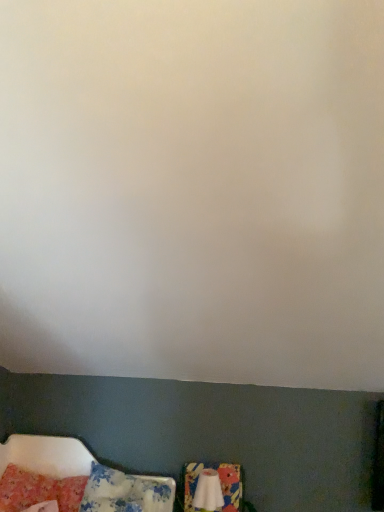
Question: Is the position of white fabric swivel chair at lower center less distant than that of fluffy cotton pillow at lower left, which is the 1th pillow in right-to-left order?

Choices:
 (A) yes
 (B) no

Answer: (B)

Question: Can you confirm if white fabric swivel chair at lower center is shorter than fluffy cotton pillow at lower left, which is the 1th pillow in right-to-left order?

Choices:
 (A) yes
 (B) no

Answer: (B)

Question: Considering the relative positions of white fabric swivel chair at lower center and fluffy cotton pillow at lower left, which is the 1th pillow in right-to-left order, in the image provided, is white fabric swivel chair at lower center to the left of fluffy cotton pillow at lower left, which is the 1th pillow in right-to-left order, from the viewer's perspective?

Choices:
 (A) no
 (B) yes

Answer: (A)

Question: Considering the relative positions of white fabric swivel chair at lower center and fluffy cotton pillow at lower left, which is the 1th pillow in right-to-left order, in the image provided, is white fabric swivel chair at lower center behind fluffy cotton pillow at lower left, which is the 1th pillow in right-to-left order,?

Choices:
 (A) yes
 (B) no

Answer: (A)

Question: Is white fabric swivel chair at lower center at the right side of fluffy cotton pillow at lower left, which is the second pillow from left to right?

Choices:
 (A) yes
 (B) no

Answer: (A)

Question: From a real-world perspective, relative to fluffy cotton pillow at lower left, which is the 1th pillow in right-to-left order, is white fabric swivel chair at lower center vertically above or below?

Choices:
 (A) above
 (B) below

Answer: (A)

Question: Is white fabric swivel chair at lower center taller or shorter than fluffy cotton pillow at lower left, which is the second pillow from left to right?

Choices:
 (A) short
 (B) tall

Answer: (B)

Question: In the image, is white fabric swivel chair at lower center on the left side or the right side of fluffy cotton pillow at lower left, which is the second pillow from left to right?

Choices:
 (A) right
 (B) left

Answer: (A)

Question: From the image's perspective, is white fabric swivel chair at lower center located above or below fluffy cotton pillow at lower left, which is the 1th pillow in right-to-left order?

Choices:
 (A) above
 (B) below

Answer: (B)

Question: From their relative heights in the image, would you say fluffy cotton pillow at lower left, which is the 1th pillow in right-to-left order, is taller or shorter than white fabric swivel chair at lower center?

Choices:
 (A) short
 (B) tall

Answer: (A)

Question: From the image's perspective, relative to white fabric swivel chair at lower center, is fluffy cotton pillow at lower left, which is the second pillow from left to right, above or below?

Choices:
 (A) above
 (B) below

Answer: (A)

Question: Looking at the image, does fluffy cotton pillow at lower left, which is the 1th pillow in right-to-left order, seem bigger or smaller compared to white fabric swivel chair at lower center?

Choices:
 (A) big
 (B) small

Answer: (A)

Question: In the image, is fluffy cotton pillow at lower left, which is the second pillow from left to right, on the left side or the right side of white fabric swivel chair at lower center?

Choices:
 (A) left
 (B) right

Answer: (A)

Question: Considering the positions of white fabric swivel chair at lower center and fluffy pink pillow at lower left, marked as the first pillow in a left-to-right arrangement, in the image, is white fabric swivel chair at lower center taller or shorter than fluffy pink pillow at lower left, marked as the first pillow in a left-to-right arrangement,?

Choices:
 (A) short
 (B) tall

Answer: (B)

Question: Is white fabric swivel chair at lower center spatially inside fluffy pink pillow at lower left, marked as the first pillow in a left-to-right arrangement, or outside of it?

Choices:
 (A) outside
 (B) inside

Answer: (A)